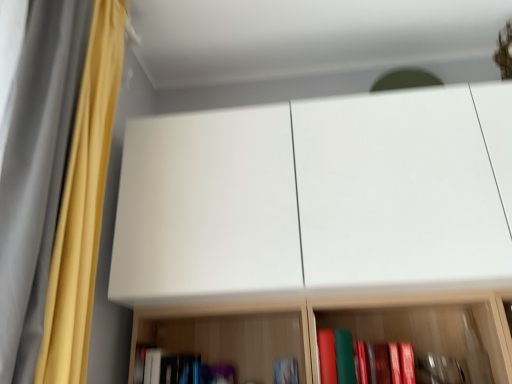
What is the approximate width of hardcover book at lower center, the 2th book viewed from the left?

2.79 centimeters.

Describe the element at coordinates (318, 198) in the screenshot. The height and width of the screenshot is (384, 512). I see `white matte cabinet at upper center` at that location.

Find the location of `hardcover book at lower center, the first book from the right`. hardcover book at lower center, the first book from the right is located at coordinates (286, 371).

Considering the positions of objects white matte cabinet at upper center and silky yellow curtain at left, positioned as the 1th curtain in front-to-back order, in the image provided, who is behind, white matte cabinet at upper center or silky yellow curtain at left, positioned as the 1th curtain in front-to-back order,?

white matte cabinet at upper center is behind.

Considering the relative sizes of white matte cabinet at upper center and silky yellow curtain at left, positioned as the 1th curtain in front-to-back order, in the image provided, is white matte cabinet at upper center smaller than silky yellow curtain at left, positioned as the 1th curtain in front-to-back order,?

Actually, white matte cabinet at upper center might be larger than silky yellow curtain at left, positioned as the 1th curtain in front-to-back order.

Are white matte cabinet at upper center and silky yellow curtain at left, positioned as the 1th curtain in front-to-back order, making contact?

No.

Looking at this image, could you tell me if white matte cabinet at upper center is turned towards silky yellow curtain at left, positioned as the 1th curtain in front-to-back order?

Yes, white matte cabinet at upper center is facing silky yellow curtain at left, positioned as the 1th curtain in front-to-back order.

Is white matte cabinet at upper center to the left of hardcover book at lower center, the first book from the right, from the viewer's perspective?

No.

Would you say white matte cabinet at upper center contains hardcover book at lower center, the 2th book viewed from the left?

No, hardcover book at lower center, the 2th book viewed from the left, is not a part of white matte cabinet at upper center.

At what (x,y) coordinates should I click in order to perform the action: click on cabinetry that is in front of the hardcover book at lower center, the 2th book viewed from the left. Please return your answer as a coordinate pair (x, y). This screenshot has height=384, width=512. Looking at the image, I should click on (318, 198).

In the scene shown: How distant is silky yellow curtain at left, positioned as the 1th curtain in front-to-back order, from yellow fabric curtain at left, which is the 2th curtain in front-to-back order?

silky yellow curtain at left, positioned as the 1th curtain in front-to-back order, and yellow fabric curtain at left, which is the 2th curtain in front-to-back order, are 12.13 centimeters apart.

Can you tell me how much silky yellow curtain at left, positioned as the 1th curtain in front-to-back order, and yellow fabric curtain at left, positioned as the 1th curtain in back-to-front order, differ in facing direction?

0.000454 degrees.

Could you tell me if silky yellow curtain at left, which is the 2th curtain from back to front, is facing yellow fabric curtain at left, positioned as the 1th curtain in back-to-front order?

No, silky yellow curtain at left, which is the 2th curtain from back to front, is not facing towards yellow fabric curtain at left, positioned as the 1th curtain in back-to-front order.

Identify the location of curtain on the right of the yellow fabric curtain at left, positioned as the 1th curtain in back-to-front order. Image resolution: width=512 pixels, height=384 pixels. (36, 172).

Considering the sizes of objects hardcover book at lower center, acting as the second book starting from the right, and white matte cabinet at upper center in the image provided, who is taller, hardcover book at lower center, acting as the second book starting from the right, or white matte cabinet at upper center?

white matte cabinet at upper center is taller.

Is hardcover book at lower center, acting as the second book starting from the right, closer to camera compared to white matte cabinet at upper center?

No, it is behind white matte cabinet at upper center.

Which is less distant, [229,376] or [302,283]?

Point [229,376].

From a real-world perspective, is hardcover book at lower center, acting as the second book starting from the right, located beneath white matte cabinet at upper center?

Yes.

Which is more to the right, hardcover book at lower center, the 2th book viewed from the left, or white matte cabinet at upper center?

white matte cabinet at upper center.

Would you say hardcover book at lower center, the 2th book viewed from the left, is outside white matte cabinet at upper center?

Yes.

From a real-world perspective, who is located lower, hardcover book at lower center, the first book from the right, or white matte cabinet at upper center?

From a 3D spatial view, hardcover book at lower center, the first book from the right, is below.

Between hardcover book at lower center, the first book from the right, and white matte cabinet at upper center, which one is positioned in front?

white matte cabinet at upper center is closer to the camera.

You are a GUI agent. You are given a task and a screenshot of the screen. Output one action in this format:
    pyautogui.click(x=<x>, y=<y>)
    Task: Click on the 2nd book located beneath the silky yellow curtain at left, which is the 2th curtain from back to front (from a real-world perspective)
    The width and height of the screenshot is (512, 384).
    Given the screenshot: What is the action you would take?
    pyautogui.click(x=286, y=371)

Who is taller, silky yellow curtain at left, which is the 2th curtain from back to front, or hardcover book at lower center, the 2th book viewed from the left?

silky yellow curtain at left, which is the 2th curtain from back to front.

Is the position of silky yellow curtain at left, which is the 2th curtain from back to front, more distant than that of hardcover book at lower center, the 2th book viewed from the left?

No, it is not.

Does silky yellow curtain at left, which is the 2th curtain from back to front, turn towards hardcover book at lower center, the 2th book viewed from the left?

No, silky yellow curtain at left, which is the 2th curtain from back to front, does not turn towards hardcover book at lower center, the 2th book viewed from the left.

Is yellow fabric curtain at left, positioned as the 1th curtain in back-to-front order, to the right of hardcover book at lower center, the 2th book viewed from the left, from the viewer's perspective?

No, yellow fabric curtain at left, positioned as the 1th curtain in back-to-front order, is not to the right of hardcover book at lower center, the 2th book viewed from the left.

Who is smaller, yellow fabric curtain at left, positioned as the 1th curtain in back-to-front order, or hardcover book at lower center, the first book from the right?

hardcover book at lower center, the first book from the right.

From the image's perspective, is yellow fabric curtain at left, which is the 2th curtain in front-to-back order, beneath hardcover book at lower center, the 2th book viewed from the left?

No.

Measure the distance from yellow fabric curtain at left, which is the 2th curtain in front-to-back order, to hardcover book at lower center, the 2th book viewed from the left.

The distance of yellow fabric curtain at left, which is the 2th curtain in front-to-back order, from hardcover book at lower center, the 2th book viewed from the left, is 38.73 inches.

From the white matte cabinet at upper center, count 2nd curtains forward and point to it. Please provide its 2D coordinates.

[(36, 172)]

Find the location of a particular element. cabinetry above the hardcover book at lower center, the 2th book viewed from the left (from a real-world perspective) is located at coordinates (318, 198).

Which object lies nearer to the anchor point hardcover book at lower center, arranged as the first book when viewed from the left, yellow fabric curtain at left, positioned as the 1th curtain in back-to-front order, or hardcover book at lower center, the 2th book viewed from the left?

Based on the image, hardcover book at lower center, the 2th book viewed from the left, appears to be nearer to hardcover book at lower center, arranged as the first book when viewed from the left.

Estimate the real-world distances between objects in this image. Which object is closer to white matte cabinet at upper center, hardcover book at lower center, the first book from the right, or yellow fabric curtain at left, positioned as the 1th curtain in back-to-front order?

Based on the image, yellow fabric curtain at left, positioned as the 1th curtain in back-to-front order, appears to be nearer to white matte cabinet at upper center.

From the image, which object appears to be nearer to yellow fabric curtain at left, positioned as the 1th curtain in back-to-front order, hardcover book at lower center, the 2th book viewed from the left, or white matte cabinet at upper center?

Among the two, white matte cabinet at upper center is located nearer to yellow fabric curtain at left, positioned as the 1th curtain in back-to-front order.

Estimate the real-world distances between objects in this image. Which object is further from yellow fabric curtain at left, which is the 2th curtain in front-to-back order, hardcover book at lower center, the first book from the right, or hardcover book at lower center, arranged as the first book when viewed from the left?

hardcover book at lower center, the first book from the right.

From the image, which object appears to be nearer to hardcover book at lower center, the first book from the right, white matte cabinet at upper center or yellow fabric curtain at left, which is the 2th curtain in front-to-back order?

Based on the image, white matte cabinet at upper center appears to be nearer to hardcover book at lower center, the first book from the right.

Based on their spatial positions, is yellow fabric curtain at left, which is the 2th curtain in front-to-back order, or hardcover book at lower center, the 2th book viewed from the left, further from silky yellow curtain at left, positioned as the 1th curtain in front-to-back order?

hardcover book at lower center, the 2th book viewed from the left.

Estimate the real-world distances between objects in this image. Which object is further from silky yellow curtain at left, which is the 2th curtain from back to front, white matte cabinet at upper center or hardcover book at lower center, acting as the second book starting from the right?

hardcover book at lower center, acting as the second book starting from the right, is further to silky yellow curtain at left, which is the 2th curtain from back to front.

Based on their spatial positions, is silky yellow curtain at left, which is the 2th curtain from back to front, or yellow fabric curtain at left, positioned as the 1th curtain in back-to-front order, further from hardcover book at lower center, the 2th book viewed from the left?

silky yellow curtain at left, which is the 2th curtain from back to front, is further to hardcover book at lower center, the 2th book viewed from the left.

Where is `curtain between yellow fabric curtain at left, positioned as the 1th curtain in back-to-front order, and hardcover book at lower center, the first book from the right, from top to bottom`? curtain between yellow fabric curtain at left, positioned as the 1th curtain in back-to-front order, and hardcover book at lower center, the first book from the right, from top to bottom is located at coordinates click(x=36, y=172).

Where is `book located between silky yellow curtain at left, which is the 2th curtain from back to front, and hardcover book at lower center, the 2th book viewed from the left, in the depth direction`? book located between silky yellow curtain at left, which is the 2th curtain from back to front, and hardcover book at lower center, the 2th book viewed from the left, in the depth direction is located at coordinates (177, 369).

This screenshot has height=384, width=512. I want to click on curtain that lies between yellow fabric curtain at left, which is the 2th curtain in front-to-back order, and hardcover book at lower center, acting as the second book starting from the right, from top to bottom, so click(x=36, y=172).

Identify the location of curtain between yellow fabric curtain at left, positioned as the 1th curtain in back-to-front order, and white matte cabinet at upper center, in the horizontal direction. This screenshot has width=512, height=384. (36, 172).